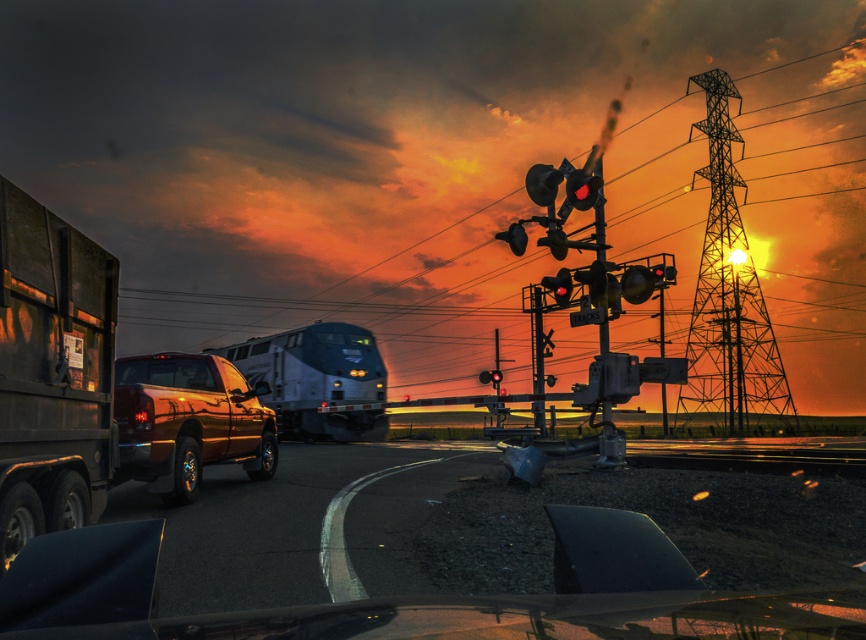
Can you confirm if dark matte trailer truck at left is shorter than red glass traffic light at center?

In fact, dark matte trailer truck at left may be taller than red glass traffic light at center.

Describe the element at coordinates (52, 372) in the screenshot. I see `dark matte trailer truck at left` at that location.

Who is more distant from viewer, (x=95, y=262) or (x=494, y=369)?

Positioned behind is point (x=494, y=369).

Identify the location of dark matte trailer truck at left. (52, 372).

Between metallic red traffic light at upper right and red glass traffic light at center, which one has less height?

metallic red traffic light at upper right

Can you confirm if metallic red traffic light at upper right is thinner than red glass traffic light at center?

Yes.

Who is more distant from viewer, [587,189] or [496,376]?

The point [496,376] is more distant.

Where is `metallic red traffic light at upper right`? Image resolution: width=866 pixels, height=640 pixels. metallic red traffic light at upper right is located at coordinates (580, 188).

Does metallic gold truck at lower left appear under matte black traffic light at upper right?

Yes, metallic gold truck at lower left is below matte black traffic light at upper right.

This screenshot has width=866, height=640. What are the coordinates of `metallic gold truck at lower left` in the screenshot? It's located at (188, 420).